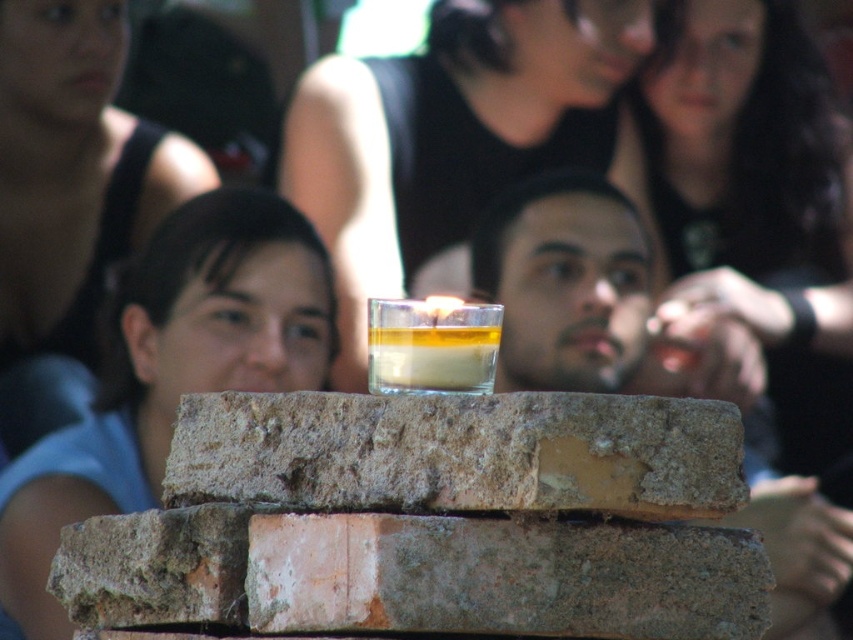
Consider the image. Does matte black hair at center have a greater width compared to matte black hair at upper left?

Yes, matte black hair at center is wider than matte black hair at upper left.

Can you confirm if matte black hair at center is taller than matte black hair at upper left?

No.

Describe the element at coordinates (457, 140) in the screenshot. I see `matte black hair at center` at that location.

The width and height of the screenshot is (853, 640). Find the location of `matte black hair at center`. matte black hair at center is located at coordinates (457, 140).

Is point (216, 444) in front of point (514, 240)?

Yes, it is.

You are a GUI agent. You are given a task and a screenshot of the screen. Output one action in this format:
    pyautogui.click(x=<x>, y=<y>)
    Task: Click on the rusty concrete block at center
    This screenshot has height=640, width=853.
    Given the screenshot: What is the action you would take?
    pyautogui.click(x=459, y=452)

Does point (302, 392) come farther from viewer compared to point (563, 253)?

That is False.

The height and width of the screenshot is (640, 853). I want to click on rusty concrete block at center, so click(459, 452).

Who is more distant from viewer, (77, 88) or (790, 572)?

Positioned behind is point (77, 88).

In order to click on matte black hair at upper left in this screenshot , I will do (68, 196).